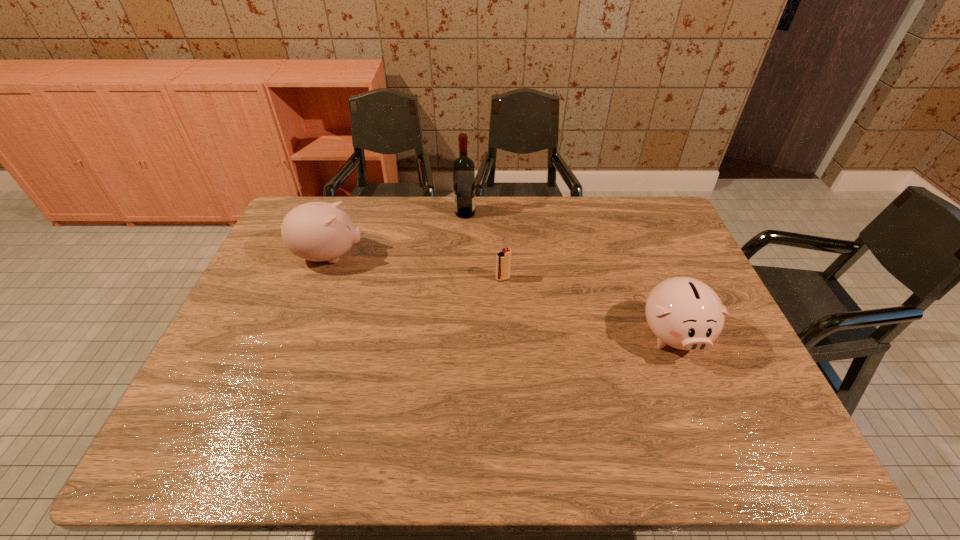
At what (x,y) coordinates should I click in order to perform the action: click on free point between the shortest object and the nearer piggy bank. Please return your answer as a coordinate pair (x, y). The image size is (960, 540). Looking at the image, I should click on (588, 306).

Locate an element on the screen. The width and height of the screenshot is (960, 540). the closest object to the tallest object is located at coordinates (503, 259).

This screenshot has width=960, height=540. I want to click on object that stands as the second closest to the alcohol, so 317,231.

I want to click on vacant region that satisfies the following two spatial constraints: 1. on the back side of the igniter; 2. on the front and back of the farthest object, so click(499, 213).

At what (x,y) coordinates should I click in order to perform the action: click on free spot that satisfies the following two spatial constraints: 1. at the snout of the rightmost object; 2. on the right side of the left piggy bank. Please return your answer as a coordinate pair (x, y). Looking at the image, I should click on (301, 333).

Where is `vacant area that satisfies the following two spatial constraints: 1. at the snout of the farther piggy bank; 2. on the right side of the nearest object`? This screenshot has width=960, height=540. vacant area that satisfies the following two spatial constraints: 1. at the snout of the farther piggy bank; 2. on the right side of the nearest object is located at coordinates (301, 333).

The height and width of the screenshot is (540, 960). What are the coordinates of `free spot that satisfies the following two spatial constraints: 1. at the snout of the nearest object; 2. on the left side of the leftmost object` in the screenshot? It's located at (301, 333).

This screenshot has height=540, width=960. What are the coordinates of `free space in the image that satisfies the following two spatial constraints: 1. at the snout of the farther piggy bank; 2. on the right side of the right piggy bank` in the screenshot? It's located at (301, 333).

Identify the location of vacant space that satisfies the following two spatial constraints: 1. at the snout of the shortest object; 2. on the right side of the farther piggy bank. The height and width of the screenshot is (540, 960). (322, 279).

Locate an element on the screen. vacant region that satisfies the following two spatial constraints: 1. on the front side of the rightmost object; 2. on the left side of the igniter is located at coordinates (506, 333).